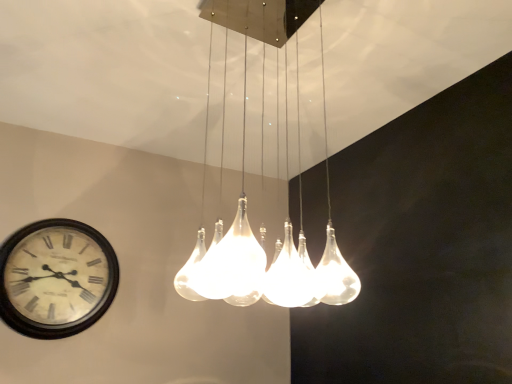
Where is `white glossy clock at lower left`? white glossy clock at lower left is located at coordinates (56, 278).

What do you see at coordinates (56, 278) in the screenshot? The width and height of the screenshot is (512, 384). I see `white glossy clock at lower left` at bounding box center [56, 278].

Locate an element on the screen. The height and width of the screenshot is (384, 512). translucent glass chandelier at center is located at coordinates (271, 272).

The width and height of the screenshot is (512, 384). What do you see at coordinates (271, 272) in the screenshot?
I see `translucent glass chandelier at center` at bounding box center [271, 272].

Find the location of a particular element. The image size is (512, 384). white glossy clock at lower left is located at coordinates (56, 278).

Is translucent glass chandelier at center at the right side of white glossy clock at lower left?

Indeed, translucent glass chandelier at center is positioned on the right side of white glossy clock at lower left.

Which object is further away from the camera, translucent glass chandelier at center or white glossy clock at lower left?

white glossy clock at lower left is further away from the camera.

Which is less distant, (x=323, y=260) or (x=88, y=317)?

The point (x=323, y=260) is closer.

From the image's perspective, is translucent glass chandelier at center located above white glossy clock at lower left?

Indeed, from the image's perspective, translucent glass chandelier at center is shown above white glossy clock at lower left.

From a real-world perspective, relative to white glossy clock at lower left, is translucent glass chandelier at center vertically above or below?

translucent glass chandelier at center is above white glossy clock at lower left.

Which object is thinner, translucent glass chandelier at center or white glossy clock at lower left?

Thinner between the two is white glossy clock at lower left.

Is translucent glass chandelier at center shorter than white glossy clock at lower left?

Incorrect, the height of translucent glass chandelier at center does not fall short of that of white glossy clock at lower left.

Considering the relative sizes of translucent glass chandelier at center and white glossy clock at lower left in the image provided, is translucent glass chandelier at center smaller than white glossy clock at lower left?

No.

Is translucent glass chandelier at center outside of white glossy clock at lower left?

That's correct, translucent glass chandelier at center is outside of white glossy clock at lower left.

Would you consider translucent glass chandelier at center to be distant from white glossy clock at lower left?

No, there isn't a large distance between translucent glass chandelier at center and white glossy clock at lower left.

Could you tell me if translucent glass chandelier at center is facing white glossy clock at lower left?

No, translucent glass chandelier at center is not oriented towards white glossy clock at lower left.

What's the angular difference between translucent glass chandelier at center and white glossy clock at lower left's facing directions?

90.3 degrees.

This screenshot has height=384, width=512. I want to click on wall clock below the translucent glass chandelier at center (from a real-world perspective), so click(56, 278).

Between white glossy clock at lower left and translucent glass chandelier at center, which one appears on the left side from the viewer's perspective?

Answer: white glossy clock at lower left.

Which object is further away from the camera, white glossy clock at lower left or translucent glass chandelier at center?

white glossy clock at lower left is more distant.

Does point (38, 240) come in front of point (219, 22)?

That is False.

From the image's perspective, is white glossy clock at lower left below translucent glass chandelier at center?

Yes, from the image's perspective, white glossy clock at lower left is below translucent glass chandelier at center.

From a real-world perspective, is white glossy clock at lower left positioned above or below translucent glass chandelier at center?

white glossy clock at lower left is below translucent glass chandelier at center.

Considering the sizes of objects white glossy clock at lower left and translucent glass chandelier at center in the image provided, who is wider, white glossy clock at lower left or translucent glass chandelier at center?

translucent glass chandelier at center is wider.

Does white glossy clock at lower left have a lesser height compared to translucent glass chandelier at center?

Indeed, white glossy clock at lower left has a lesser height compared to translucent glass chandelier at center.

Considering the relative sizes of white glossy clock at lower left and translucent glass chandelier at center in the image provided, is white glossy clock at lower left bigger than translucent glass chandelier at center?

No.

Is white glossy clock at lower left not within translucent glass chandelier at center?

Indeed, white glossy clock at lower left is completely outside translucent glass chandelier at center.

Are white glossy clock at lower left and translucent glass chandelier at center located far from each other?

They are positioned close to each other.

Does white glossy clock at lower left turn towards translucent glass chandelier at center?

Yes, white glossy clock at lower left faces towards translucent glass chandelier at center.

Locate an element on the screen. lamp to the right of white glossy clock at lower left is located at coordinates (271, 272).

There is a white glossy clock at lower left. Where is `lamp above it (from a real-world perspective)`? The width and height of the screenshot is (512, 384). lamp above it (from a real-world perspective) is located at coordinates coord(271,272).

Identify the location of wall clock on the left of translucent glass chandelier at center. (56, 278).